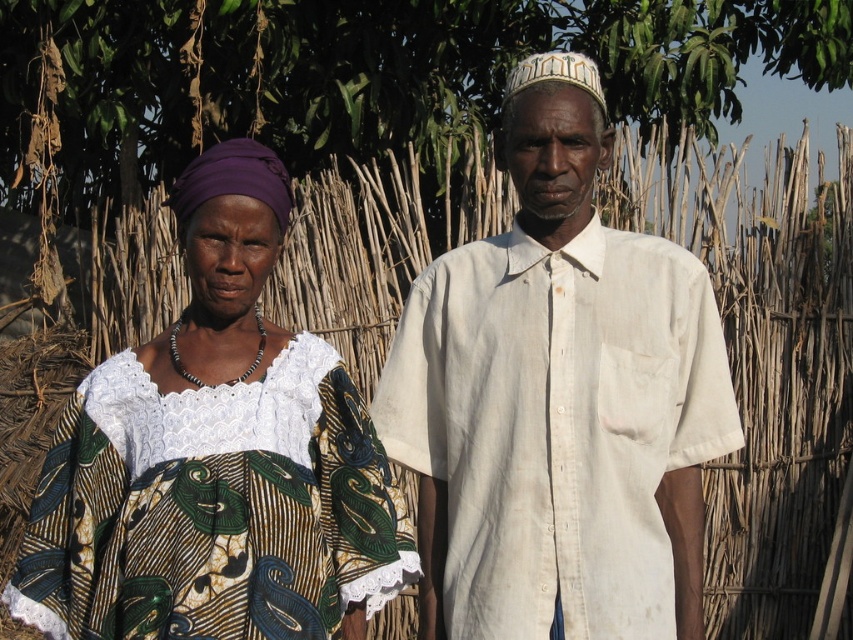
You are a photographer planning to take a photo of the two people in the scene. You want to ensure that both subjects are in focus. The camera you are using has a depth of field that can only cover up to 0.08 units. Given the coordinates of their positions as point [444,625] and point [393,534], will both subjects be in focus?

Point [444,625] is behind point [393,534]. The distance between them is 0.145 units, which exceeds the camera depth of field of 0.08 units. Therefore, both subjects cannot be in focus simultaneously.

Based on the photo, you are a photographer trying to capture a portrait of the two people in the scene. You want to ensure that the white cotton shirt at center is positioned exactly at the center of the image. Currently, it is located at point 0.625, 0.655. Should you move the camera to the left or right to center it?

The white cotton shirt at center is currently at point (558, 400). To center it, you should move the camera to the left since the x coordinate 0.625 is greater than 0.5, which is the center point. This adjustment will bring the shirt closer to the center of the image.